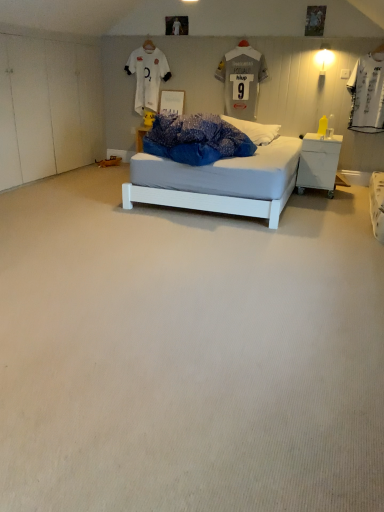
Question: From a real-world perspective, is gray fabric jersey at upper center, the first t shirt from the right, positioned above or below white carpet at center?

Choices:
 (A) above
 (B) below

Answer: (A)

Question: From the image's perspective, relative to white carpet at center, is gray fabric jersey at upper center, the first t shirt from the right, above or below?

Choices:
 (A) below
 (B) above

Answer: (B)

Question: Considering the real-world distances, which object is farthest from the gray fabric jersey at upper center, the first t shirt from the right?

Choices:
 (A) white jersey at upper center, which is the 1th t shirt in left-to-right order
 (B) white carpet at center
 (C) white plastic nightstand at right

Answer: (B)

Question: Estimate the real-world distances between objects in this image. Which object is closer to the white carpet at center?

Choices:
 (A) white plastic nightstand at right
 (B) gray fabric jersey at upper center, which ranks as the second t shirt in left-to-right order
 (C) white jersey at upper center, which is the 1th t shirt in left-to-right order

Answer: (A)